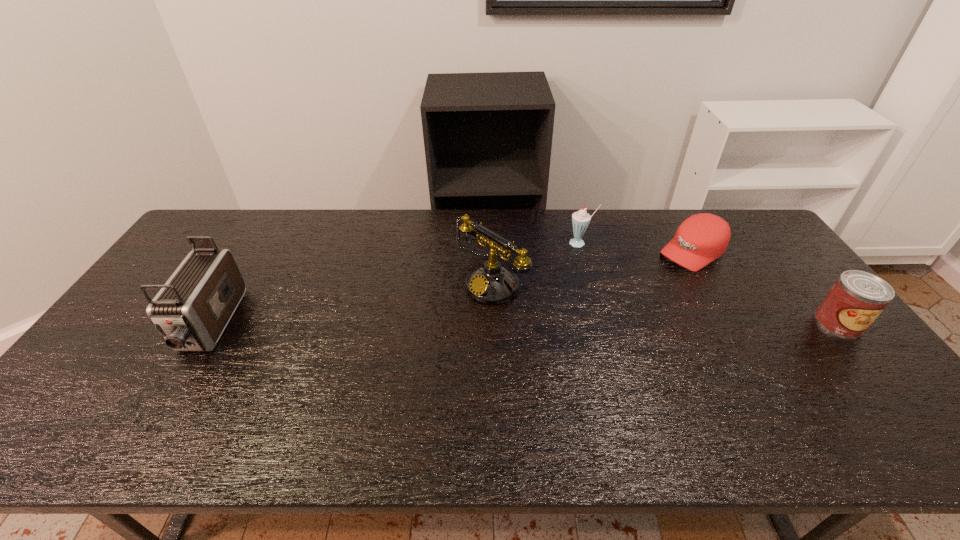
Where is `object at the right edge`? object at the right edge is located at coordinates (857, 298).

Identify the location of free spot at the far edge of the desktop. The height and width of the screenshot is (540, 960). (375, 247).

Identify the location of free space at the near edge of the desktop. (372, 390).

Locate an element on the screen. The width and height of the screenshot is (960, 540). free space at the left edge of the desktop is located at coordinates (99, 357).

Locate an element on the screen. Image resolution: width=960 pixels, height=540 pixels. vacant space at the right edge of the desktop is located at coordinates (749, 275).

The height and width of the screenshot is (540, 960). In order to click on free space at the far right corner of the desktop in this screenshot , I will do `click(759, 234)`.

Where is `empty space that is in between the fourth object from left to right and the third object from right to left`? empty space that is in between the fourth object from left to right and the third object from right to left is located at coordinates (636, 247).

In order to click on vacant point located between the fourth object from right to left and the shortest object in this screenshot , I will do `click(591, 268)`.

Identify the location of free area in between the second object from left to right and the third object from right to left. (536, 263).

Locate an element on the screen. vacant space in between the camcorder and the can is located at coordinates (524, 324).